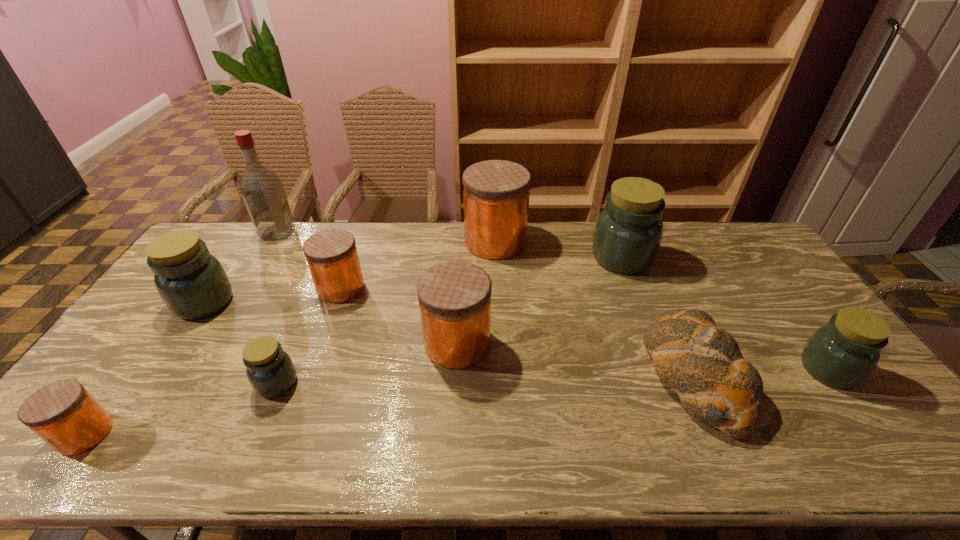
In order to click on free location that satisfies the following two spatial constraints: 1. on the front side of the bread; 2. on the left side of the third farthest orange jar in this screenshot , I will do `click(456, 375)`.

Where is `vacant space that satisfies the following two spatial constraints: 1. on the back side of the smallest orange jar; 2. on the right side of the third orange jar from right to left`? vacant space that satisfies the following two spatial constraints: 1. on the back side of the smallest orange jar; 2. on the right side of the third orange jar from right to left is located at coordinates (192, 288).

Where is `vacant area that satisfies the following two spatial constraints: 1. on the front-facing side of the second biggest orange jar; 2. on the right side of the tallest object`? The height and width of the screenshot is (540, 960). vacant area that satisfies the following two spatial constraints: 1. on the front-facing side of the second biggest orange jar; 2. on the right side of the tallest object is located at coordinates (211, 343).

Identify the location of free spot that satisfies the following two spatial constraints: 1. on the front-facing side of the tallest object; 2. on the back side of the second smallest orange jar. (245, 288).

Find the location of a particular element. The height and width of the screenshot is (540, 960). free space that satisfies the following two spatial constraints: 1. on the front side of the second farthest orange jar; 2. on the right side of the bread is located at coordinates (310, 375).